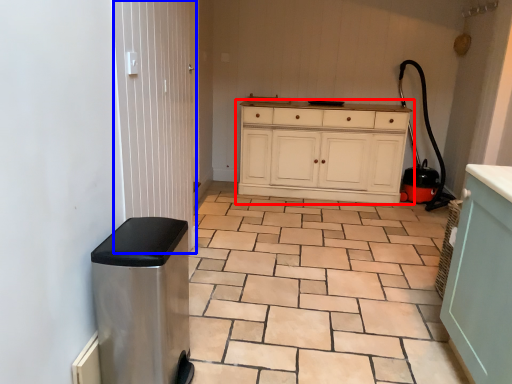
Question: Among these objects, which one is nearest to the camera, chest of drawers (highlighted by a red box) or screen door (highlighted by a blue box)?

Choices:
 (A) chest of drawers
 (B) screen door

Answer: (B)